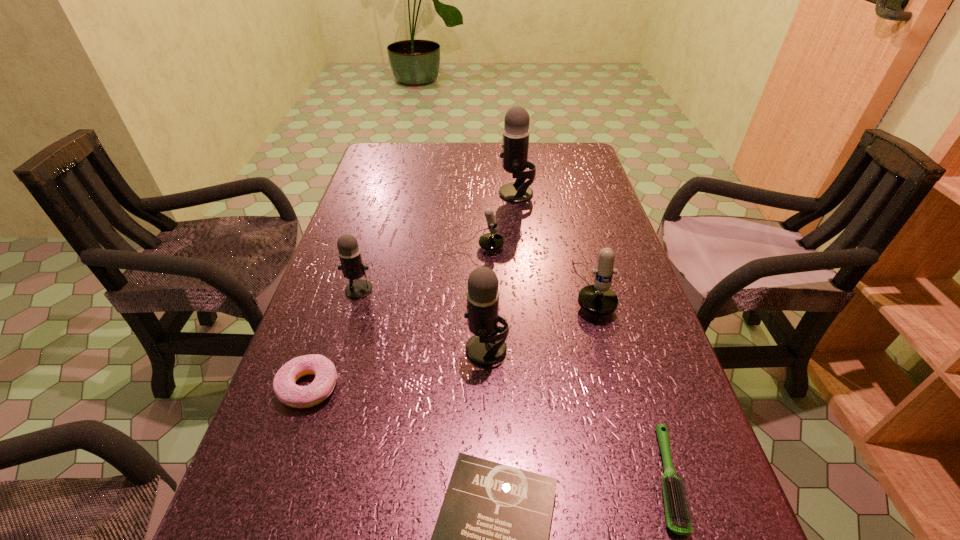
Identify the location of microphone at the left edge. coord(349,252).

Where is `doughnut that is at the left edge`? Image resolution: width=960 pixels, height=540 pixels. doughnut that is at the left edge is located at coordinates (287, 391).

Where is `microphone that is at the right edge`? Image resolution: width=960 pixels, height=540 pixels. microphone that is at the right edge is located at coordinates (599, 299).

Where is `hairbrush that is at the right edge`? hairbrush that is at the right edge is located at coordinates (678, 520).

Where is `vacant space at the far edge of the desktop`? The width and height of the screenshot is (960, 540). vacant space at the far edge of the desktop is located at coordinates (499, 163).

Where is `vacant space at the left edge of the desktop`? The image size is (960, 540). vacant space at the left edge of the desktop is located at coordinates (365, 326).

Where is `vacant space at the right edge of the desktop`? vacant space at the right edge of the desktop is located at coordinates pyautogui.click(x=684, y=440).

You are a GUI agent. You are given a task and a screenshot of the screen. Output one action in this format:
    pyautogui.click(x=<x>, y=<y>)
    Task: Click on the free space at the far left corner of the desktop
    
    Given the screenshot: What is the action you would take?
    pyautogui.click(x=402, y=160)

This screenshot has width=960, height=540. Identify the location of free spot between the smallest gray microphone and the third shortest object. (334, 338).

Identify the location of vacant space in between the light hairbrush and the rightmost microphone. (629, 384).